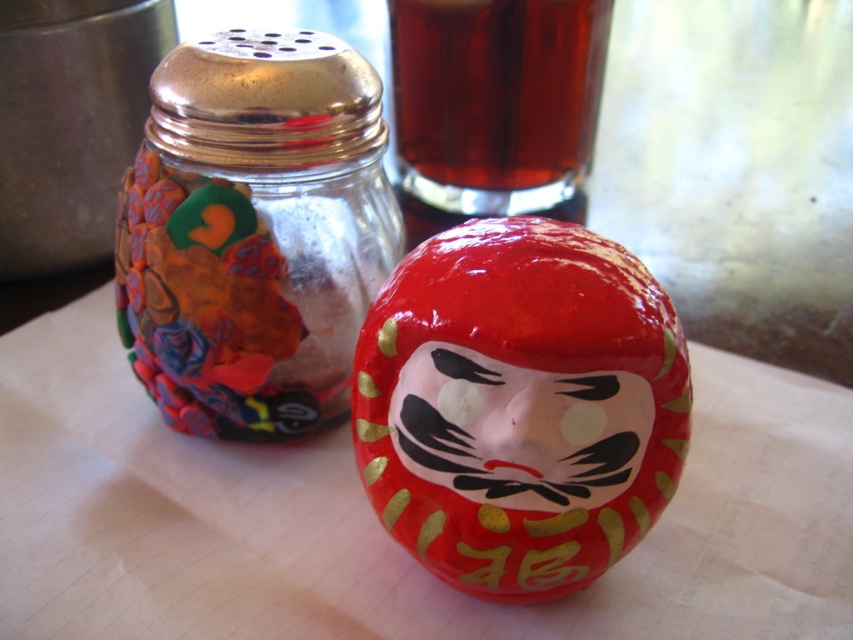
Between point (189, 253) and point (440, 416), which one is positioned in front?

Positioned in front is point (440, 416).

Is multicolored glass jar at left taller than glossy ceramic face at center?

Correct, multicolored glass jar at left is much taller as glossy ceramic face at center.

Is point (329, 84) in front of point (612, 416)?

No, it is behind (612, 416).

This screenshot has width=853, height=640. I want to click on multicolored glass jar at left, so click(x=253, y=232).

Can you confirm if brown liquid at upper center is shorter than glossy ceramic face at center?

No.

How far apart are brown liquid at upper center and glossy ceramic face at center?

They are 29.21 inches apart.

I want to click on brown liquid at upper center, so click(496, 100).

Is multicolored glass jar at left further to camera compared to brown liquid at upper center?

No, it is not.

Looking at this image, between multicolored glass jar at left and brown liquid at upper center, which one is positioned lower?

multicolored glass jar at left

Find the location of `multicolored glass jar at left`. multicolored glass jar at left is located at coordinates (253, 232).